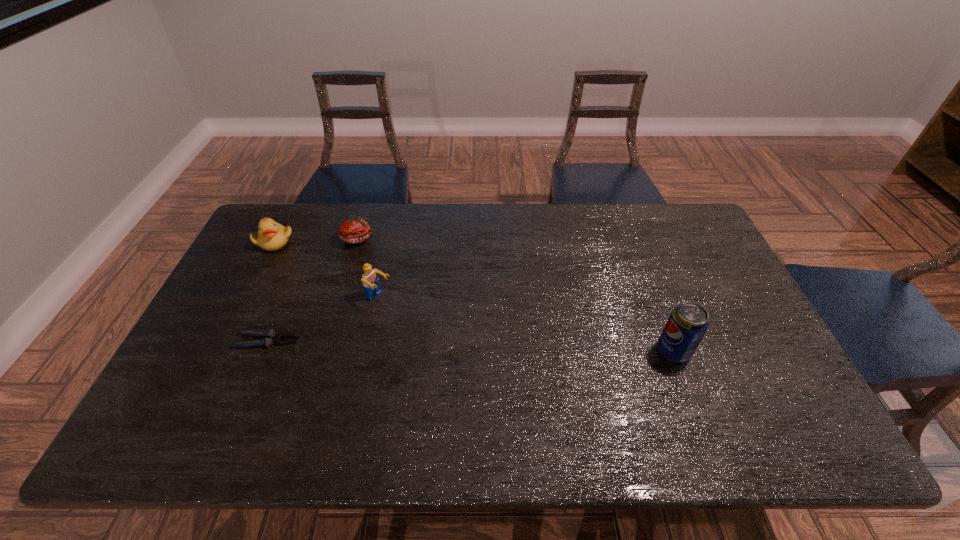
Image resolution: width=960 pixels, height=540 pixels. What are the coordinates of `object that is the closest to the pliers` in the screenshot? It's located at (370, 280).

Where is `free space that satisfies the following two spatial constraints: 1. on the front side of the duckling; 2. at the gripping part of the pliers`? The width and height of the screenshot is (960, 540). free space that satisfies the following two spatial constraints: 1. on the front side of the duckling; 2. at the gripping part of the pliers is located at coordinates (225, 341).